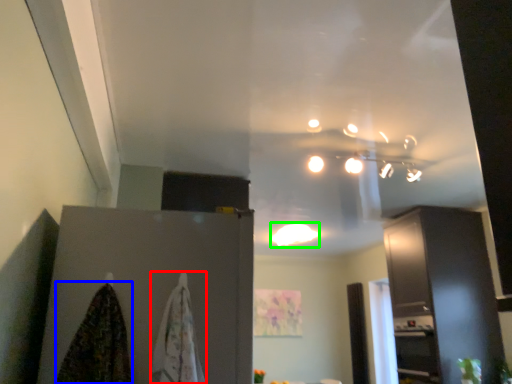
Question: Which is farther away from blanket (highlighted by a red box)? blanket (highlighted by a blue box) or lighting (highlighted by a green box)?

Choices:
 (A) blanket
 (B) lighting

Answer: (B)